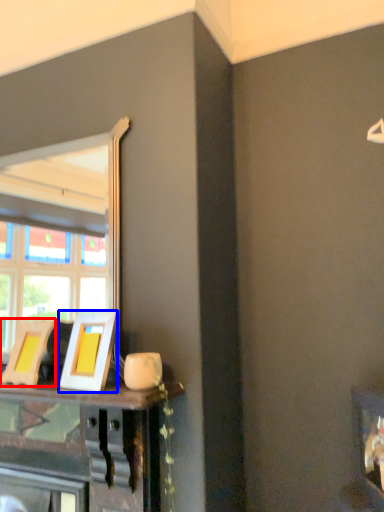
Question: Which object appears closest to the camera in this image, picture frame (highlighted by a red box) or picture frame (highlighted by a blue box)?

Choices:
 (A) picture frame
 (B) picture frame

Answer: (B)